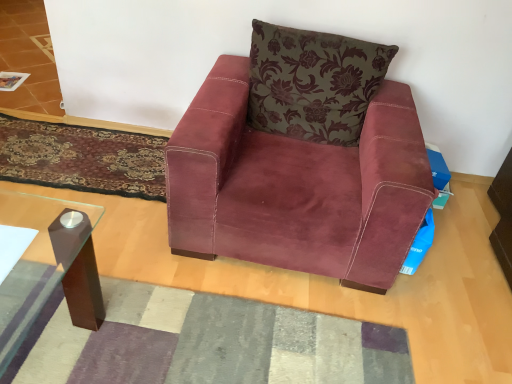
The width and height of the screenshot is (512, 384). What are the coordinates of `free space above velvet-like burgundy mat at lower left, placed as the 1th mat when sorted from top to bottom (from a real-world perspective)` in the screenshot? It's located at (76, 150).